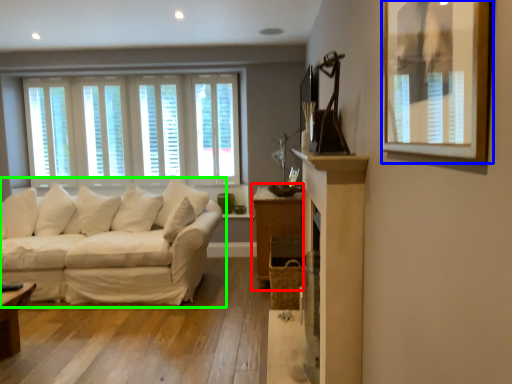
Question: Which object is the farthest from dresser (highlighted by a red box)? Choose among these: picture frame (highlighted by a blue box) or studio couch (highlighted by a green box).

Choices:
 (A) picture frame
 (B) studio couch

Answer: (A)